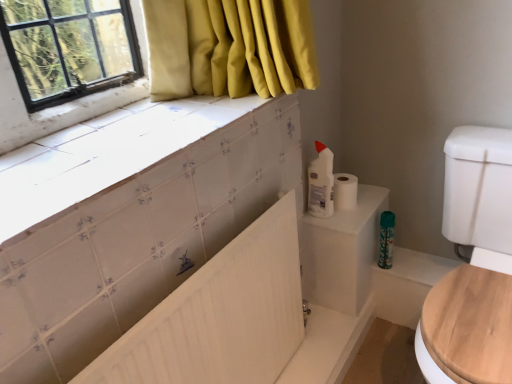
Image resolution: width=512 pixels, height=384 pixels. What do you see at coordinates (345, 191) in the screenshot? I see `white matte toilet paper at upper right` at bounding box center [345, 191].

What is the approximate height of white glossy tile at upper left?

The height of white glossy tile at upper left is 1.60 inches.

This screenshot has width=512, height=384. I want to click on white glossy tile at upper left, so click(x=106, y=154).

What are the coordinates of `white matte radiator at center` in the screenshot? It's located at (220, 315).

This screenshot has height=384, width=512. What do you see at coordinates (386, 239) in the screenshot?
I see `green plastic spray bottle at lower right, which is the 1th cleaning product in back-to-front order` at bounding box center [386, 239].

I want to click on white matte toilet paper at upper right, so click(x=345, y=191).

You are a GUI agent. You are given a task and a screenshot of the screen. Output one action in this format:
    pyautogui.click(x=<x>, y=<y>)
    Task: Click on the sit that appears below the green plastic spray bottle at lower right, which is the 1th cleaning product in back-to-front order (from the image's perspective)
    
    Given the screenshot: What is the action you would take?
    pyautogui.click(x=473, y=265)

Looking at this image, from the image's perspective, would you say green plastic spray bottle at lower right, which is counted as the 2th cleaning product, starting from the front, is positioned over wooden at right?

Yes, from the image's perspective, green plastic spray bottle at lower right, which is counted as the 2th cleaning product, starting from the front, is on top of wooden at right.

Could you tell me if green plastic spray bottle at lower right, which is counted as the 2th cleaning product, starting from the front, is turned towards wooden at right?

No, green plastic spray bottle at lower right, which is counted as the 2th cleaning product, starting from the front, is not turned towards wooden at right.

Considering the relative sizes of green plastic spray bottle at lower right, the 2th cleaning product when ordered from top to bottom, and wooden at right in the image provided, is green plastic spray bottle at lower right, the 2th cleaning product when ordered from top to bottom, thinner than wooden at right?

Yes, green plastic spray bottle at lower right, the 2th cleaning product when ordered from top to bottom, is thinner than wooden at right.

Is white matte radiator at center at the back of wooden at right?

No, wooden at right is not facing the opposite direction of white matte radiator at center.

Considering the positions of objects wooden at right and white matte radiator at center in the image provided, who is more to the left, wooden at right or white matte radiator at center?

From the viewer's perspective, white matte radiator at center appears more on the left side.

Would you say wooden at right is outside white matte radiator at center?

Yes, wooden at right is located beyond the bounds of white matte radiator at center.

From a real-world perspective, is wooden at right physically below white matte radiator at center?

Indeed, from a real-world perspective, wooden at right is positioned beneath white matte radiator at center.

Can you confirm if green plastic spray bottle at lower right, the 2th cleaning product when ordered from top to bottom, is positioned to the right of white glossy tile at upper left?

Yes.

Considering the sizes of green plastic spray bottle at lower right, which is the 1th cleaning product in back-to-front order, and white glossy tile at upper left in the image, is green plastic spray bottle at lower right, which is the 1th cleaning product in back-to-front order, wider or thinner than white glossy tile at upper left?

Clearly, green plastic spray bottle at lower right, which is the 1th cleaning product in back-to-front order, has less width compared to white glossy tile at upper left.

From a real-world perspective, is green plastic spray bottle at lower right, which is the 1th cleaning product in back-to-front order, physically located above or below white glossy tile at upper left?

In terms of real-world spatial position, green plastic spray bottle at lower right, which is the 1th cleaning product in back-to-front order, is below white glossy tile at upper left.

In the scene shown: Which point is more distant from viewer, (392, 244) or (247, 99)?

Point (392, 244)

Is wooden at right to the left of white plastic bottle at upper right, the 1th cleaning product from the front, from the viewer's perspective?

In fact, wooden at right is to the right of white plastic bottle at upper right, the 1th cleaning product from the front.

From a real-world perspective, relative to white plastic bottle at upper right, the second cleaning product positioned from the back, is wooden at right vertically above or below?

Clearly, from a real-world perspective, wooden at right is below white plastic bottle at upper right, the second cleaning product positioned from the back.

Considering the relative sizes of wooden at right and white plastic bottle at upper right, the second cleaning product positioned from the back, in the image provided, is wooden at right thinner than white plastic bottle at upper right, the second cleaning product positioned from the back,?

In fact, wooden at right might be wider than white plastic bottle at upper right, the second cleaning product positioned from the back.

Does point (462, 187) appear closer or farther from the camera than point (315, 169)?

Point (462, 187) is positioned closer to the camera compared to point (315, 169).

Which is closer to the camera, (339, 208) or (220, 278)?

Positioned in front is point (220, 278).

Visually, is white matte toilet paper at upper right positioned to the left or to the right of white matte radiator at center?

Clearly, white matte toilet paper at upper right is on the right of white matte radiator at center in the image.

Is white matte toilet paper at upper right positioned in front of white matte radiator at center?

No, white matte toilet paper at upper right is further to the viewer.

You are a GUI agent. You are given a task and a screenshot of the screen. Output one action in this format:
    pyautogui.click(x=<x>, y=<y>)
    Task: Click on the bath below the white matte toilet paper at upper right (from the image's perspective)
    The image size is (512, 384).
    Given the screenshot: What is the action you would take?
    pyautogui.click(x=220, y=315)

Can you confirm if white matte radiator at center is positioned to the right of white glossy tile at upper left?

Correct, you'll find white matte radiator at center to the right of white glossy tile at upper left.

You are a GUI agent. You are given a task and a screenshot of the screen. Output one action in this format:
    pyautogui.click(x=<x>, y=<y>)
    Task: Click on the counter top in front of the white matte radiator at center
    The width and height of the screenshot is (512, 384).
    Given the screenshot: What is the action you would take?
    pyautogui.click(x=106, y=154)

Would you consider white matte radiator at center to be distant from white glossy tile at upper left?

That's not correct — white matte radiator at center is a little close to white glossy tile at upper left.

Can you confirm if white matte radiator at center is shorter than white glossy tile at upper left?

No.

From the image's perspective, is white plastic bottle at upper right, the 1th cleaning product from the front, located above white matte toilet paper at upper right?

Yes, from the image's perspective, white plastic bottle at upper right, the 1th cleaning product from the front, is on top of white matte toilet paper at upper right.

Consider the image. Do you think white plastic bottle at upper right, the 1th cleaning product when ordered from left to right, is within white matte toilet paper at upper right, or outside of it?

white plastic bottle at upper right, the 1th cleaning product when ordered from left to right, is located beyond the bounds of white matte toilet paper at upper right.

There is a white matte toilet paper at upper right. Where is `cleaning product above it (from a real-world perspective)`? The image size is (512, 384). cleaning product above it (from a real-world perspective) is located at coordinates (321, 183).

Between white plastic bottle at upper right, the 1th cleaning product from the front, and white matte toilet paper at upper right, which one has larger width?

With larger width is white matte toilet paper at upper right.

Where is `the 1st cleaning product to the left of the wooden at right, starting your count from the anchor`? This screenshot has height=384, width=512. the 1st cleaning product to the left of the wooden at right, starting your count from the anchor is located at coordinates (386, 239).

The image size is (512, 384). I want to click on sit on the right of white matte radiator at center, so click(473, 265).

In the scene shown: Estimate the real-world distances between objects in this image. Which object is closer to green plastic spray bottle at lower right, which is counted as the 2th cleaning product, starting from the front, white matte radiator at center or white glossy tile at upper left?

The object closer to green plastic spray bottle at lower right, which is counted as the 2th cleaning product, starting from the front, is white matte radiator at center.

Which object lies nearer to the anchor point white plastic bottle at upper right, the 2th cleaning product when ordered from bottom to top, white matte radiator at center or green plastic spray bottle at lower right, which is counted as the 2th cleaning product, starting from the front?

Among the two, green plastic spray bottle at lower right, which is counted as the 2th cleaning product, starting from the front, is located nearer to white plastic bottle at upper right, the 2th cleaning product when ordered from bottom to top.

Which object lies further to the anchor point green plastic spray bottle at lower right, the 1th cleaning product from the right, white matte toilet paper at upper right or white matte radiator at center?

The object further to green plastic spray bottle at lower right, the 1th cleaning product from the right, is white matte radiator at center.

When comparing their distances from green plastic spray bottle at lower right, which is counted as the 2th cleaning product, starting from the front, does white glossy tile at upper left or wooden at right seem closer?

Based on the image, wooden at right appears to be nearer to green plastic spray bottle at lower right, which is counted as the 2th cleaning product, starting from the front.

Estimate the real-world distances between objects in this image. Which object is further from white matte toilet paper at upper right, green plastic spray bottle at lower right, the 2th cleaning product when ordered from top to bottom, or white glossy tile at upper left?

Among the two, white glossy tile at upper left is located further to white matte toilet paper at upper right.

When comparing their distances from white glossy tile at upper left, does white matte radiator at center or green plastic spray bottle at lower right, positioned as the second cleaning product in left-to-right order, seem further?

The object further to white glossy tile at upper left is green plastic spray bottle at lower right, positioned as the second cleaning product in left-to-right order.

Based on their spatial positions, is white glossy tile at upper left or white plastic bottle at upper right, the 2th cleaning product when ordered from bottom to top, closer to wooden at right?

white plastic bottle at upper right, the 2th cleaning product when ordered from bottom to top, is positioned closer to the anchor wooden at right.

Estimate the real-world distances between objects in this image. Which object is closer to white matte toilet paper at upper right, white plastic bottle at upper right, the 1th cleaning product from the front, or wooden at right?

Among the two, white plastic bottle at upper right, the 1th cleaning product from the front, is located nearer to white matte toilet paper at upper right.

Find the location of `toilet paper between white matte radiator at center and green plastic spray bottle at lower right, the 2th cleaning product when ordered from top to bottom, along the z-axis`. toilet paper between white matte radiator at center and green plastic spray bottle at lower right, the 2th cleaning product when ordered from top to bottom, along the z-axis is located at coordinates (345, 191).

This screenshot has height=384, width=512. Identify the location of sit positioned between white matte radiator at center and green plastic spray bottle at lower right, acting as the 1th cleaning product starting from the bottom, from near to far. (473, 265).

This screenshot has height=384, width=512. Find the location of `toilet paper between wooden at right and green plastic spray bottle at lower right, which is counted as the 2th cleaning product, starting from the front, in the front-back direction`. toilet paper between wooden at right and green plastic spray bottle at lower right, which is counted as the 2th cleaning product, starting from the front, in the front-back direction is located at coordinates (345, 191).

Locate an element on the screen. The width and height of the screenshot is (512, 384). cleaning product between white matte radiator at center and green plastic spray bottle at lower right, positioned as the second cleaning product in left-to-right order, in the front-back direction is located at coordinates (321, 183).